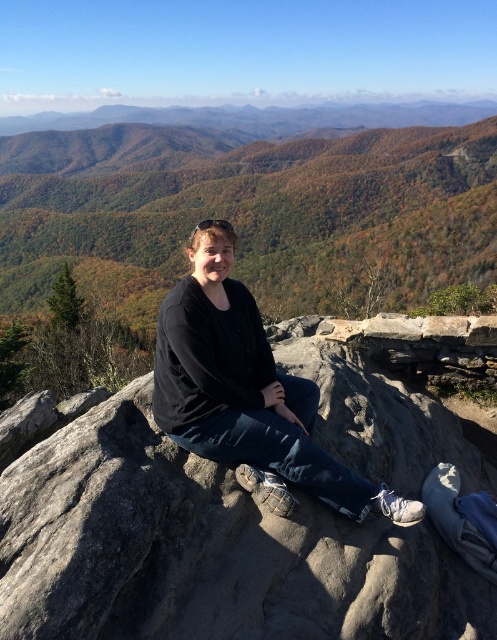
You are a photographer trying to capture the person in the scene. Since the gray rough rock at center and the black matte shirt at center are both at the center, which one is closer to the camera?

The gray rough rock at center is shorter than the black matte shirt at center, so the gray rough rock at center is closer to the camera.

Where is the gray rough rock at center located in the image?

The gray rough rock at center is located at point (204, 550) in the image.

You are a photographer trying to capture the perfect shot of the two points in the image. Which of the two points, point (322, 573) or point (165, 310), is closer to your camera lens?

Point (322, 573) is closer to the camera than point (165, 310).